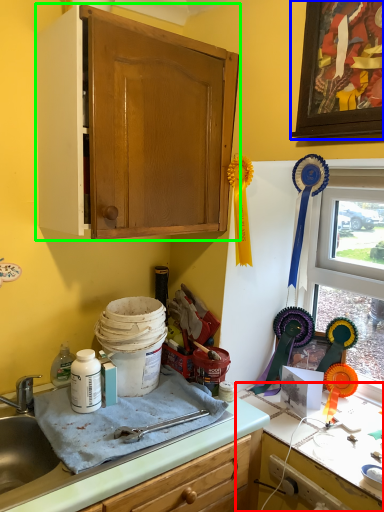
Question: Based on their relative distances, which object is farther from countertop (highlighted by a red box)? Choose from picture frame (highlighted by a blue box) and cabinetry (highlighted by a green box).

Choices:
 (A) picture frame
 (B) cabinetry

Answer: (A)